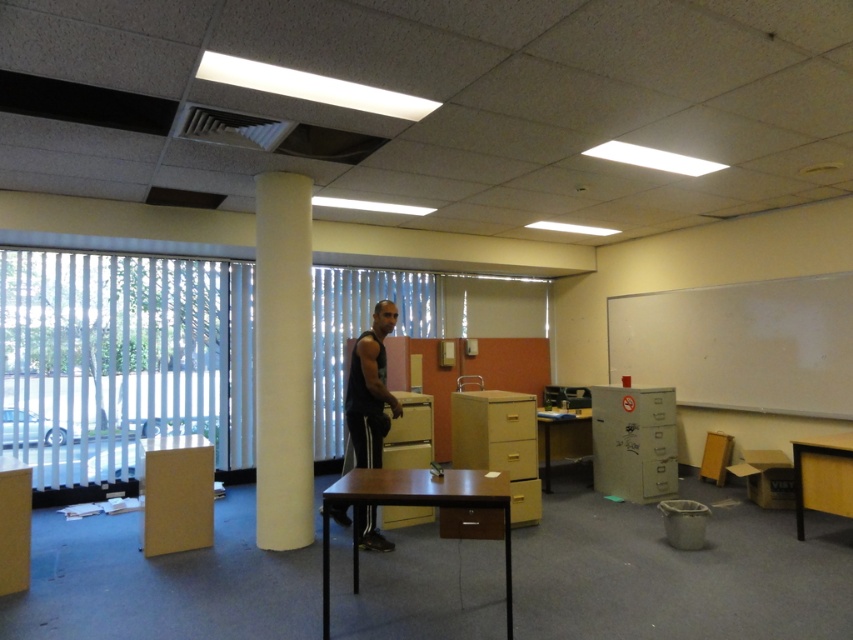
Is white matte column at center positioned at the back of metallic gray file cabinet at right?

No, it is in front of metallic gray file cabinet at right.

Between white matte column at center and metallic gray file cabinet at right, which one has more height?

Standing taller between the two is white matte column at center.

You are a GUI agent. You are given a task and a screenshot of the screen. Output one action in this format:
    pyautogui.click(x=<x>, y=<y>)
    Task: Click on the white matte column at center
    Image resolution: width=853 pixels, height=640 pixels.
    Given the screenshot: What is the action you would take?
    pyautogui.click(x=283, y=362)

Is brown cardboard file cabinet at center taller than yellow matte/file cabinet at center?

Indeed, brown cardboard file cabinet at center has a greater height compared to yellow matte/file cabinet at center.

Does point (508, 461) come closer to viewer compared to point (432, 435)?

That is True.

Describe the element at coordinates (498, 444) in the screenshot. I see `brown cardboard file cabinet at center` at that location.

Locate an element on the screen. This screenshot has width=853, height=640. brown cardboard file cabinet at center is located at coordinates (498, 444).

Looking at this image, is yellow matte/file cabinet at center to the right of wooden desk at center from the viewer's perspective?

No, yellow matte/file cabinet at center is not to the right of wooden desk at center.

Does yellow matte/file cabinet at center have a greater height compared to wooden desk at center?

Incorrect, yellow matte/file cabinet at center's height is not larger of wooden desk at center's.

Where is `yellow matte/file cabinet at center`? yellow matte/file cabinet at center is located at coordinates (410, 433).